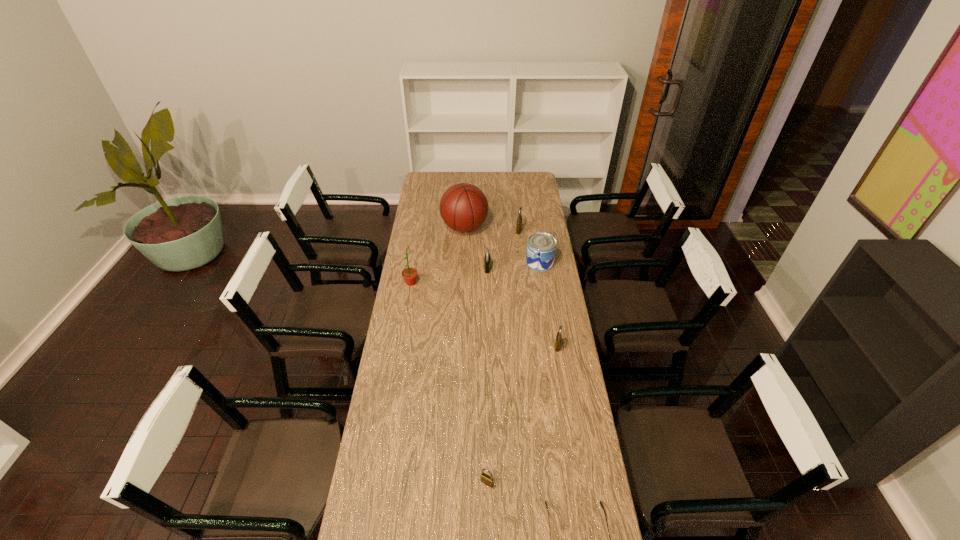
In order to click on basketball in this screenshot , I will do `click(463, 207)`.

The width and height of the screenshot is (960, 540). What are the coordinates of `the leftmost object` in the screenshot? It's located at (409, 274).

This screenshot has width=960, height=540. I want to click on green sunflower, so click(409, 274).

Find the location of a particular element. This screenshot has width=960, height=540. the second brass padlock from left to right is located at coordinates (519, 220).

Identify the location of the farthest brass padlock. [519, 220].

This screenshot has height=540, width=960. Find the location of `can`. can is located at coordinates (541, 247).

Identify the location of black padlock. The width and height of the screenshot is (960, 540). (487, 259).

Image resolution: width=960 pixels, height=540 pixels. I want to click on the third farthest padlock, so click(x=559, y=336).

Find the location of `the rightmost brass padlock`. the rightmost brass padlock is located at coordinates (559, 336).

Identify the location of the nearest padlock. (488, 480).